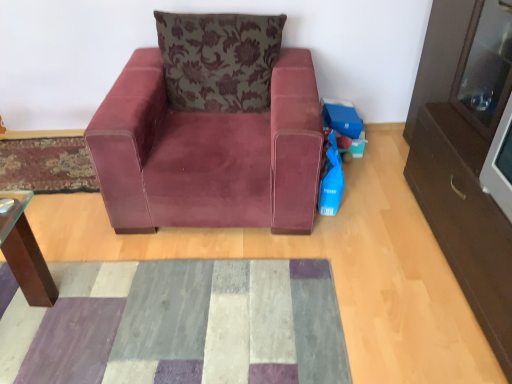
Question: Relative to velvet-like rug at lower left, the second mat viewed from the front, is velvet floral pillow at upper center in front or behind?

Choices:
 (A) behind
 (B) front

Answer: (B)

Question: Does point (257, 99) appear closer or farther from the camera than point (38, 155)?

Choices:
 (A) farther
 (B) closer

Answer: (B)

Question: Which is nearer to the velvet-like rug at lower left, the 2th mat ordered from the bottom?

Choices:
 (A) velvet maroon armchair at center
 (B) blue plastic toy at lower right
 (C) patchwork fabric mat at center, placed as the first mat when sorted from bottom to top
 (D) velvet floral pillow at upper center

Answer: (A)

Question: Estimate the real-world distances between objects in this image. Which object is farther from the velvet maroon armchair at center?

Choices:
 (A) velvet-like rug at lower left, the 1th mat in the back-to-front sequence
 (B) patchwork fabric mat at center, placed as the first mat when sorted from bottom to top
 (C) velvet floral pillow at upper center
 (D) blue plastic toy at lower right

Answer: (A)